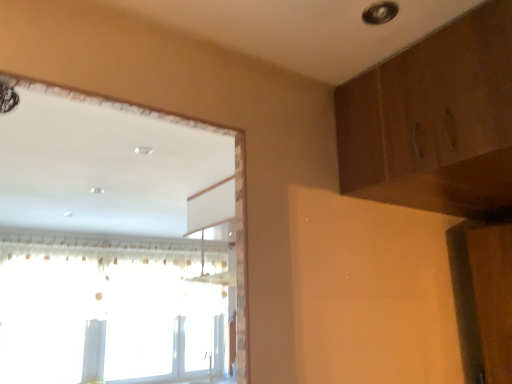
This screenshot has width=512, height=384. Identify the location of transparent plastic window at upper left. (105, 309).

Where is `wooden dresser at upper right`? wooden dresser at upper right is located at coordinates (435, 121).

What is the approximate height of wooden dresser at upper right?

16.99 inches.

I want to click on white sheer curtain at left, so click(x=98, y=247).

Looking at this image, is wooden dresser at upper right touching transparent plastic window at upper left?

There is a gap between wooden dresser at upper right and transparent plastic window at upper left.

Measure the distance from wooden dresser at upper right to transparent plastic window at upper left.

A distance of 12.26 feet exists between wooden dresser at upper right and transparent plastic window at upper left.

How different are the orientations of wooden dresser at upper right and transparent plastic window at upper left in degrees?

The angle between the facing direction of wooden dresser at upper right and the facing direction of transparent plastic window at upper left is 90.5 degrees.

Looking at this image, would you say transparent plastic window at upper left is part of wooden dresser at upper right's contents?

That's incorrect, transparent plastic window at upper left is not inside wooden dresser at upper right.

Is transparent plastic window at upper left closer to camera compared to white sheer curtain at left?

No, it is behind white sheer curtain at left.

How far apart are transparent plastic window at upper left and white sheer curtain at left?

transparent plastic window at upper left and white sheer curtain at left are 16.31 inches apart.

There is a transparent plastic window at upper left. Identify the location of curtain above it (from a real-world perspective). This screenshot has width=512, height=384. (98, 247).

Who is shorter, transparent plastic window at upper left or white sheer curtain at left?

white sheer curtain at left is shorter.

Is white sheer curtain at left facing away from transparent plastic window at upper left?

Correct, white sheer curtain at left is looking away from transparent plastic window at upper left.

Which is behind, white sheer curtain at left or transparent plastic window at upper left?

transparent plastic window at upper left is more distant.

Which object is wider, white sheer curtain at left or transparent plastic window at upper left?

white sheer curtain at left is wider.

From the image's perspective, which is below, white sheer curtain at left or transparent plastic window at upper left?

transparent plastic window at upper left is shown below in the image.

Does transparent plastic window at upper left turn towards wooden dresser at upper right?

Yes, transparent plastic window at upper left is turned towards wooden dresser at upper right.

Is transparent plastic window at upper left outside of wooden dresser at upper right?

transparent plastic window at upper left lies outside wooden dresser at upper right's area.

Between transparent plastic window at upper left and wooden dresser at upper right, which one has larger size?

Bigger between the two is transparent plastic window at upper left.

Considering the sizes of transparent plastic window at upper left and wooden dresser at upper right in the image, is transparent plastic window at upper left wider or thinner than wooden dresser at upper right?

In the image, transparent plastic window at upper left appears to be more narrow than wooden dresser at upper right.

Considering the positions of objects wooden dresser at upper right and white sheer curtain at left in the image provided, who is more to the right, wooden dresser at upper right or white sheer curtain at left?

wooden dresser at upper right.

Is wooden dresser at upper right taller or shorter than white sheer curtain at left?

In the image, wooden dresser at upper right appears to be shorter than white sheer curtain at left.

Is white sheer curtain at left completely or partially inside wooden dresser at upper right?

No.

From a real-world perspective, is wooden dresser at upper right positioned above or below white sheer curtain at left?

Clearly, from a real-world perspective, wooden dresser at upper right is above white sheer curtain at left.

Which is further, (108,244) or (430,154)?

Point (108,244)

Between white sheer curtain at left and wooden dresser at upper right, which one has less height?

Standing shorter between the two is wooden dresser at upper right.

Is the depth of white sheer curtain at left greater than that of wooden dresser at upper right?

Yes, white sheer curtain at left is further from the camera.

From a real-world perspective, which object stands above the other?

In real-world perspective, wooden dresser at upper right is above.

Where is `dresser above the transparent plastic window at upper left (from the image's perspective)`? This screenshot has width=512, height=384. dresser above the transparent plastic window at upper left (from the image's perspective) is located at coordinates [435, 121].

Find the location of a particular element. The height and width of the screenshot is (384, 512). curtain in front of the transparent plastic window at upper left is located at coordinates 98,247.

Estimate the real-world distances between objects in this image. Which object is closer to white sheer curtain at left, wooden dresser at upper right or transparent plastic window at upper left?

Based on the image, transparent plastic window at upper left appears to be nearer to white sheer curtain at left.

Considering their positions, is white sheer curtain at left positioned closer to transparent plastic window at upper left than wooden dresser at upper right?

white sheer curtain at left lies closer to transparent plastic window at upper left than the other object.

Which object lies nearer to the anchor point wooden dresser at upper right, transparent plastic window at upper left or white sheer curtain at left?

white sheer curtain at left is positioned closer to the anchor wooden dresser at upper right.

Based on their spatial positions, is wooden dresser at upper right or white sheer curtain at left closer to transparent plastic window at upper left?

white sheer curtain at left is positioned closer to the anchor transparent plastic window at upper left.

Based on their spatial positions, is transparent plastic window at upper left or wooden dresser at upper right closer to white sheer curtain at left?

transparent plastic window at upper left is closer to white sheer curtain at left.

In the scene shown: Considering their positions, is white sheer curtain at left positioned closer to wooden dresser at upper right than transparent plastic window at upper left?

Based on the image, white sheer curtain at left appears to be nearer to wooden dresser at upper right.

What are the coordinates of `curtain located between wooden dresser at upper right and transparent plastic window at upper left in the depth direction` in the screenshot? It's located at (98, 247).